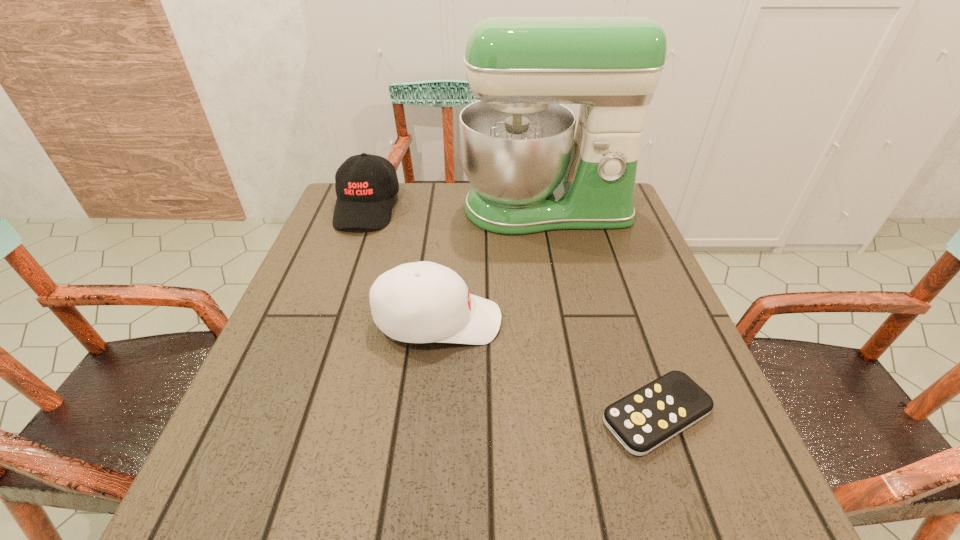
I want to click on the tallest object, so click(530, 173).

I want to click on the left baseball cap, so click(x=365, y=184).

What are the coordinates of `the farther baseball cap` in the screenshot? It's located at (365, 184).

Where is `the right baseball cap`? This screenshot has width=960, height=540. the right baseball cap is located at coordinates (421, 302).

This screenshot has width=960, height=540. I want to click on the second nearest object, so click(x=421, y=302).

You are a GUI agent. You are given a task and a screenshot of the screen. Output one action in this format:
    pyautogui.click(x=<x>, y=<y>)
    Task: Click on the remote control
    The height and width of the screenshot is (540, 960).
    Given the screenshot: What is the action you would take?
    pyautogui.click(x=641, y=421)

Where is `the shortest object`? This screenshot has width=960, height=540. the shortest object is located at coordinates (641, 421).

This screenshot has height=540, width=960. In order to click on vacant position located 0.220m on the controls of the tallest object in this screenshot , I will do `click(564, 300)`.

I want to click on vacant region located 0.160m on the front-facing side of the farther baseball cap, so click(343, 276).

The width and height of the screenshot is (960, 540). I want to click on vacant area situated on the front-facing side of the third farthest object, so click(x=648, y=321).